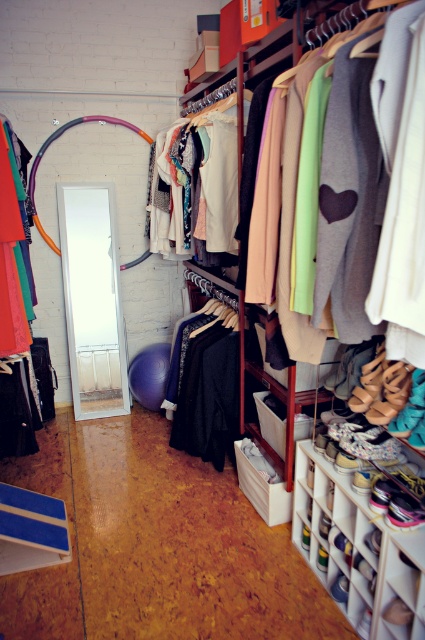
Question: Is white plastic shoe rack at lower right to the left of matte orange fabric at left from the viewer's perspective?

Choices:
 (A) no
 (B) yes

Answer: (A)

Question: Can you confirm if matte fabric clothes at center is positioned below matte orange fabric at left?

Choices:
 (A) yes
 (B) no

Answer: (B)

Question: Can you confirm if white plastic shoe rack at lower right is positioned above matte orange fabric at left?

Choices:
 (A) yes
 (B) no

Answer: (B)

Question: Estimate the real-world distances between objects in this image. Which object is farther from the matte orange fabric at left?

Choices:
 (A) white plastic shoe rack at lower right
 (B) matte fabric clothes at center

Answer: (A)

Question: Among these points, which one is nearest to the camera?

Choices:
 (A) (339, 476)
 (B) (10, 212)

Answer: (A)

Question: Which is farther from the matte orange fabric at left?

Choices:
 (A) matte fabric clothes at center
 (B) white plastic shoe rack at lower right

Answer: (B)